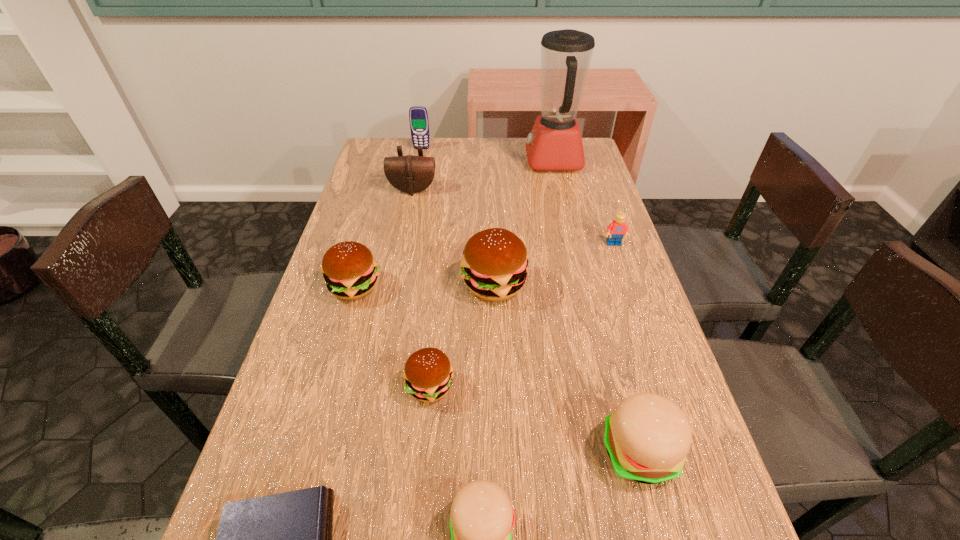
This screenshot has height=540, width=960. I want to click on the tallest object, so click(x=555, y=144).

Where is `cellular telephone`? This screenshot has height=540, width=960. cellular telephone is located at coordinates (418, 116).

Where is `the tallest hamburger`? The height and width of the screenshot is (540, 960). the tallest hamburger is located at coordinates (494, 265).

You are a GUI agent. You are given a task and a screenshot of the screen. Output one action in this format:
    pyautogui.click(x=<x>, y=<y>)
    Task: Click on the rightmost brown hamburger
    This screenshot has width=960, height=540.
    Given the screenshot: What is the action you would take?
    pyautogui.click(x=494, y=265)

At what (x,y) coordinates should I click in order to perform the action: click on pouch. Please return your answer as a coordinate pair (x, y). The width and height of the screenshot is (960, 540). Looking at the image, I should click on (410, 174).

Locate an element on the screen. the third farthest object is located at coordinates (410, 174).

Where is `the leftmost hamburger`? the leftmost hamburger is located at coordinates (350, 271).

This screenshot has height=540, width=960. Find the location of `the leftmost brown hamburger`. the leftmost brown hamburger is located at coordinates (350, 271).

Find the location of `the eighth farthest object`. the eighth farthest object is located at coordinates (647, 438).

Identify the location of the rightmost hamburger. (647, 438).